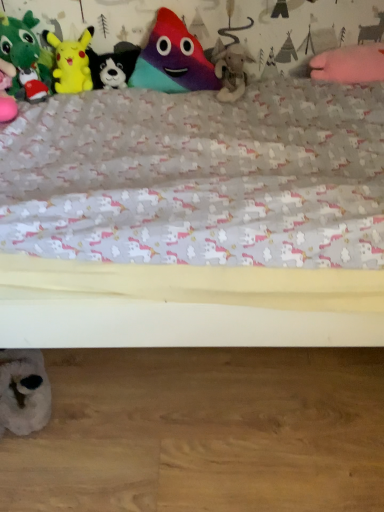
Question: Can you confirm if green plush toy at left, marked as the third toy in a top-to-bottom arrangement, is positioned to the left of multicolored plush toy at center, the 1th toy from the top?

Choices:
 (A) yes
 (B) no

Answer: (A)

Question: Does green plush toy at left, marked as the third toy in a top-to-bottom arrangement, turn towards multicolored plush toy at center, which is the 6th toy from bottom to top?

Choices:
 (A) yes
 (B) no

Answer: (B)

Question: Is green plush toy at left, arranged as the fourth toy when ordered from the bottom, looking in the opposite direction of multicolored plush toy at center, which is the 6th toy from bottom to top?

Choices:
 (A) yes
 (B) no

Answer: (B)

Question: Does green plush toy at left, arranged as the fourth toy when ordered from the bottom, lie behind multicolored plush toy at center, the 1th toy from the top?

Choices:
 (A) no
 (B) yes

Answer: (A)

Question: Is green plush toy at left, marked as the third toy in a top-to-bottom arrangement, placed right next to multicolored plush toy at center, which is the 6th toy from bottom to top?

Choices:
 (A) yes
 (B) no

Answer: (B)

Question: Choose the correct answer: Is multicolored plush toy at center, which is the 6th toy from bottom to top, inside green plush toy at left, arranged as the fourth toy when ordered from the bottom, or outside it?

Choices:
 (A) inside
 (B) outside

Answer: (B)

Question: Does point (173, 90) appear closer or farther from the camera than point (6, 22)?

Choices:
 (A) closer
 (B) farther

Answer: (B)

Question: From the image's perspective, is multicolored plush toy at center, which is the 6th toy from bottom to top, located above or below green plush toy at left, marked as the third toy in a top-to-bottom arrangement?

Choices:
 (A) above
 (B) below

Answer: (A)

Question: In terms of size, does multicolored plush toy at center, which is the 6th toy from bottom to top, appear bigger or smaller than green plush toy at left, marked as the third toy in a top-to-bottom arrangement?

Choices:
 (A) small
 (B) big

Answer: (A)

Question: Is fuzzy beige stuffed animal at center, which is the second toy in bottom-to-top order, to the left or to the right of yellow plush at upper left, acting as the second toy starting from the top, in the image?

Choices:
 (A) right
 (B) left

Answer: (A)

Question: Considering the positions of fuzzy beige stuffed animal at center, which is the second toy in bottom-to-top order, and yellow plush at upper left, the 5th toy positioned from the bottom, in the image, is fuzzy beige stuffed animal at center, which is the second toy in bottom-to-top order, bigger or smaller than yellow plush at upper left, the 5th toy positioned from the bottom,?

Choices:
 (A) big
 (B) small

Answer: (A)

Question: From a real-world perspective, relative to yellow plush at upper left, the 5th toy positioned from the bottom, is fuzzy beige stuffed animal at center, which is the fifth toy from top to bottom, vertically above or below?

Choices:
 (A) above
 (B) below

Answer: (B)

Question: Is fuzzy beige stuffed animal at center, which is the second toy in bottom-to-top order, in front of or behind yellow plush at upper left, the 5th toy positioned from the bottom, in the image?

Choices:
 (A) front
 (B) behind

Answer: (A)

Question: In terms of width, does black plush dog at upper center, the third toy from the bottom, look wider or thinner when compared to fuzzy beige stuffed animal at center, which is the second toy in bottom-to-top order?

Choices:
 (A) thin
 (B) wide

Answer: (A)

Question: Considering their positions, is black plush dog at upper center, the third toy from the bottom, located in front of or behind fuzzy beige stuffed animal at center, which is the second toy in bottom-to-top order?

Choices:
 (A) front
 (B) behind

Answer: (B)